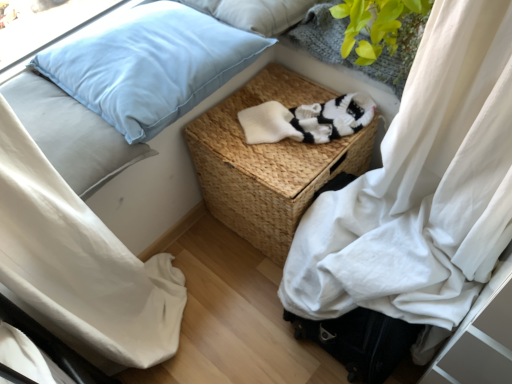
Question: Should I look upward or downward to see light blue fabric pillow at upper left, the 1th pillow from the top?

Choices:
 (A) up
 (B) down

Answer: (A)

Question: Is light blue fabric pillow at upper left, the 1th pillow from the top, oriented away from light blue fabric pillow at upper left, which ranks as the third pillow in top-to-bottom order?

Choices:
 (A) no
 (B) yes

Answer: (A)

Question: From a real-world perspective, is light blue fabric pillow at upper left, the third pillow from the bottom, over light blue fabric pillow at upper left, acting as the 1th pillow starting from the bottom?

Choices:
 (A) yes
 (B) no

Answer: (A)

Question: From a real-world perspective, is light blue fabric pillow at upper left, the third pillow from the bottom, below light blue fabric pillow at upper left, which ranks as the third pillow in top-to-bottom order?

Choices:
 (A) yes
 (B) no

Answer: (B)

Question: Is light blue fabric pillow at upper left, the 1th pillow from the top, next to light blue fabric pillow at upper left, acting as the 1th pillow starting from the bottom, and touching it?

Choices:
 (A) no
 (B) yes

Answer: (A)

Question: Does light blue fabric pillow at upper left, the 1th pillow from the top, have a lesser width compared to light blue fabric pillow at upper left, acting as the 1th pillow starting from the bottom?

Choices:
 (A) no
 (B) yes

Answer: (B)

Question: Is light blue fabric pillow at upper left, the 1th pillow from the top, positioned before light blue fabric pillow at upper left, which ranks as the third pillow in top-to-bottom order?

Choices:
 (A) no
 (B) yes

Answer: (A)

Question: Is light blue fabric pillow at upper left, which is the second pillow from bottom to top, to the right of green knitted plant at upper right from the viewer's perspective?

Choices:
 (A) no
 (B) yes

Answer: (A)

Question: Is light blue fabric pillow at upper left, which is the second pillow from bottom to top, facing away from green knitted plant at upper right?

Choices:
 (A) no
 (B) yes

Answer: (A)

Question: Is the depth of light blue fabric pillow at upper left, positioned as the second pillow in top-to-bottom order, less than that of green knitted plant at upper right?

Choices:
 (A) no
 (B) yes

Answer: (A)

Question: From the image's perspective, would you say light blue fabric pillow at upper left, which is the second pillow from bottom to top, is positioned over green knitted plant at upper right?

Choices:
 (A) yes
 (B) no

Answer: (B)

Question: Is light blue fabric pillow at upper left, positioned as the second pillow in top-to-bottom order, positioned far away from green knitted plant at upper right?

Choices:
 (A) no
 (B) yes

Answer: (A)

Question: Does light blue fabric pillow at upper left, positioned as the second pillow in top-to-bottom order, have a lesser height compared to green knitted plant at upper right?

Choices:
 (A) no
 (B) yes

Answer: (B)

Question: Is white knitted socks at center smaller than light blue fabric pillow at upper left, which ranks as the third pillow in top-to-bottom order?

Choices:
 (A) yes
 (B) no

Answer: (A)